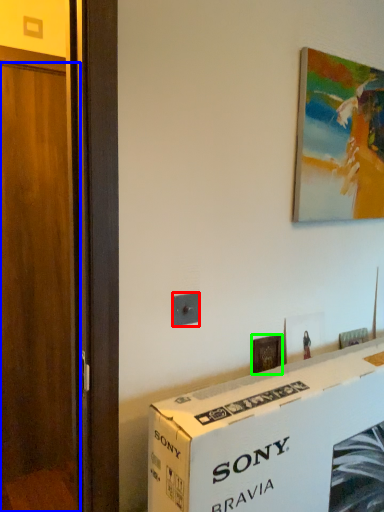
Question: Based on their relative distances, which object is farther from electric outlet (highlighted by a red box)? Choose from door (highlighted by a blue box) and picture frame (highlighted by a green box).

Choices:
 (A) door
 (B) picture frame

Answer: (A)